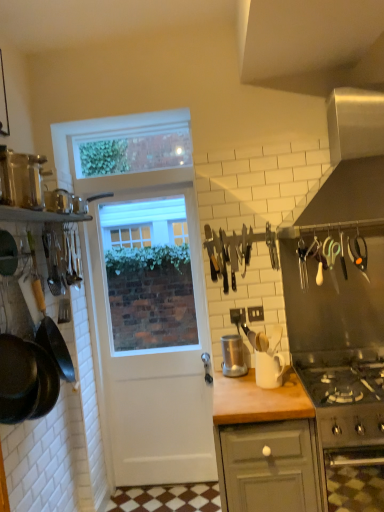
Question: Is metallic stainless steel blender at center, which is counted as the 2th kitchen appliance, starting from the top, taller than black metal knife set at center?

Choices:
 (A) no
 (B) yes

Answer: (A)

Question: Considering the relative sizes of metallic stainless steel blender at center, positioned as the 2th kitchen appliance in bottom-to-top order, and black metal knife set at center in the image provided, is metallic stainless steel blender at center, positioned as the 2th kitchen appliance in bottom-to-top order, shorter than black metal knife set at center?

Choices:
 (A) no
 (B) yes

Answer: (B)

Question: Considering the relative positions of metallic stainless steel blender at center, the first kitchen appliance viewed from the back, and black metal knife set at center in the image provided, is metallic stainless steel blender at center, the first kitchen appliance viewed from the back, to the right of black metal knife set at center from the viewer's perspective?

Choices:
 (A) no
 (B) yes

Answer: (A)

Question: From the image's perspective, is metallic stainless steel blender at center, arranged as the second kitchen appliance when viewed from the left, located beneath black metal knife set at center?

Choices:
 (A) no
 (B) yes

Answer: (B)

Question: Is black metal knife set at center at the back of metallic stainless steel blender at center, the 3th kitchen appliance when ordered from front to back?

Choices:
 (A) yes
 (B) no

Answer: (B)

Question: Can you confirm if metallic stainless steel blender at center, arranged as the 2th kitchen appliance when viewed from the right, is smaller than black metal knife set at center?

Choices:
 (A) yes
 (B) no

Answer: (A)

Question: Considering the relative sizes of stainless steel oven at lower right and black matte frying pan at left in the image provided, is stainless steel oven at lower right smaller than black matte frying pan at left?

Choices:
 (A) no
 (B) yes

Answer: (A)

Question: Can you confirm if stainless steel oven at lower right is positioned to the right of black matte frying pan at left?

Choices:
 (A) yes
 (B) no

Answer: (A)

Question: From the image's perspective, does stainless steel oven at lower right appear higher than black matte frying pan at left?

Choices:
 (A) no
 (B) yes

Answer: (A)

Question: Could you tell me if stainless steel oven at lower right is facing black matte frying pan at left?

Choices:
 (A) yes
 (B) no

Answer: (B)

Question: Is stainless steel oven at lower right touching black matte frying pan at left?

Choices:
 (A) no
 (B) yes

Answer: (A)

Question: Can you confirm if stainless steel oven at lower right is positioned to the left of black matte frying pan at left?

Choices:
 (A) no
 (B) yes

Answer: (A)

Question: From a real-world perspective, does black matte frying pan at left sit lower than metallic stainless steel blender at center, arranged as the second kitchen appliance when viewed from the left?

Choices:
 (A) no
 (B) yes

Answer: (A)